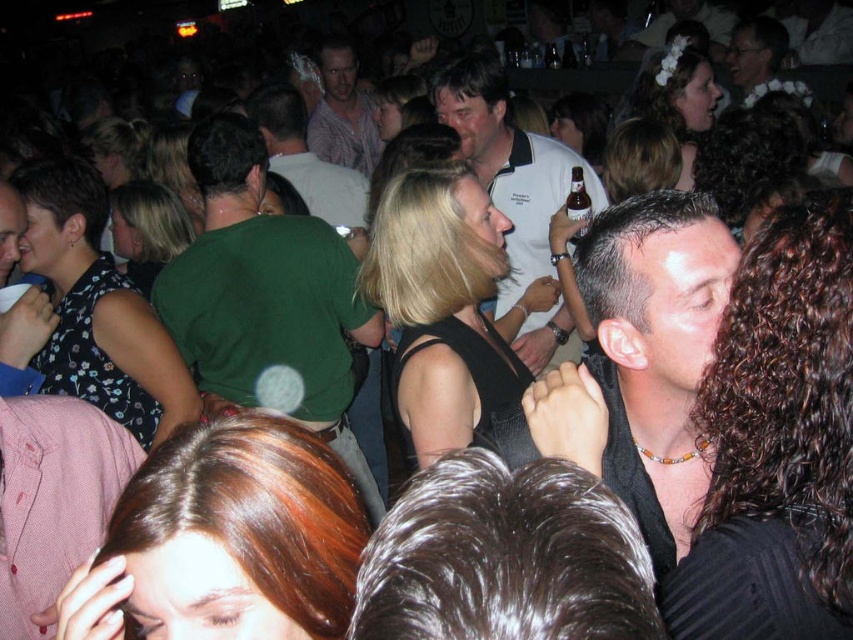
Does point (239, 321) come in front of point (320, 67)?

Yes, point (239, 321) is closer to viewer.

Does green cotton shirt at center have a greater height compared to plaid shirt at center?

Yes.

Is point (198, 269) positioned before point (368, 154)?

Yes.

At what (x,y) coordinates should I click in order to perform the action: click on green cotton shirt at center. Please return your answer as a coordinate pair (x, y). The image size is (853, 640). Looking at the image, I should click on (265, 296).

Can you confirm if black matte shirt at center is positioned to the left of plaid shirt at center?

Incorrect, black matte shirt at center is not on the left side of plaid shirt at center.

This screenshot has width=853, height=640. What do you see at coordinates (654, 349) in the screenshot?
I see `black matte shirt at center` at bounding box center [654, 349].

This screenshot has width=853, height=640. Find the location of `black matte shirt at center`. black matte shirt at center is located at coordinates coord(654,349).

Between black matte shirt at center and white polo shirt at center, which one is positioned higher?

white polo shirt at center is above.

Which is behind, point (660, 529) or point (534, 189)?

Point (534, 189)

Is point (579, 260) in front of point (525, 188)?

Yes, it is.

This screenshot has width=853, height=640. Find the location of `black matte shirt at center`. black matte shirt at center is located at coordinates (654, 349).